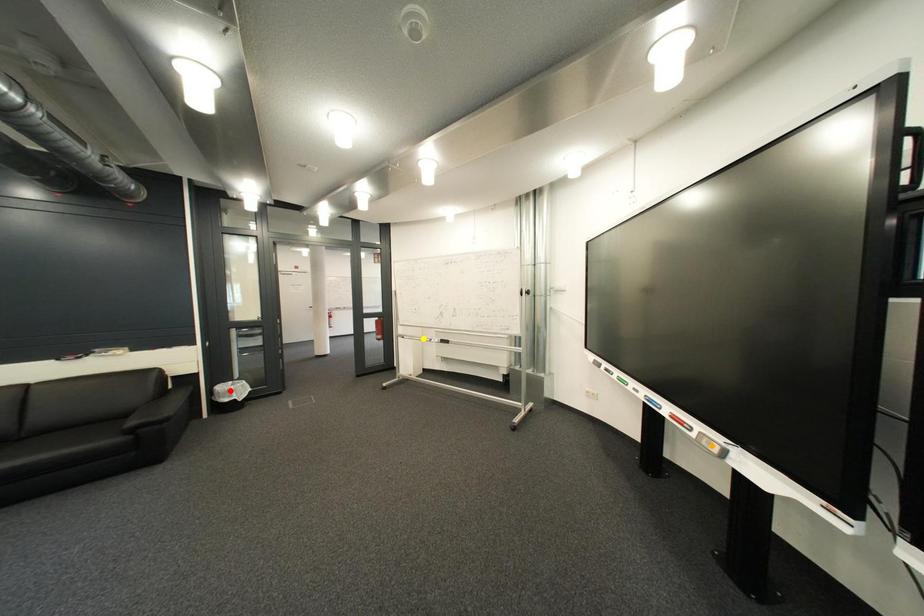
Order these from nearest to farthest:
yellow point, red point, orange point

orange point → red point → yellow point